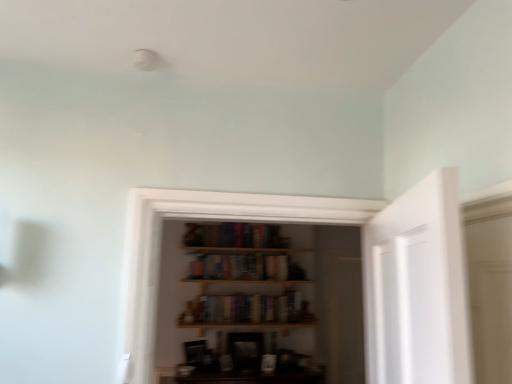
Question: In the image, is hardcover books at center, the first book from the top, positioned in front of or behind hardcover books at center, the first book from the bottom?

Choices:
 (A) behind
 (B) front

Answer: (A)

Question: Considering the positions of hardcover books at center, the first book from the top, and hardcover books at center, the 2th book when ordered from top to bottom, in the image, is hardcover books at center, the first book from the top, bigger or smaller than hardcover books at center, the 2th book when ordered from top to bottom,?

Choices:
 (A) small
 (B) big

Answer: (B)

Question: Visually, is hardcover books at center, the first book from the top, positioned to the left or to the right of hardcover books at center, the 2th book when ordered from top to bottom?

Choices:
 (A) right
 (B) left

Answer: (B)

Question: Is point (231, 309) positioned closer to the camera than point (223, 266)?

Choices:
 (A) farther
 (B) closer

Answer: (B)

Question: Choose the correct answer: Is hardcover books at center, the first book from the bottom, inside hardcover books at center, which is counted as the 2th book, starting from the bottom, or outside it?

Choices:
 (A) outside
 (B) inside

Answer: (A)

Question: From the image's perspective, relative to hardcover books at center, the first book from the top, is hardcover books at center, the 2th book when ordered from top to bottom, above or below?

Choices:
 (A) below
 (B) above

Answer: (A)

Question: From a real-world perspective, is hardcover books at center, the 2th book when ordered from top to bottom, physically located above or below hardcover books at center, the first book from the top?

Choices:
 (A) below
 (B) above

Answer: (A)